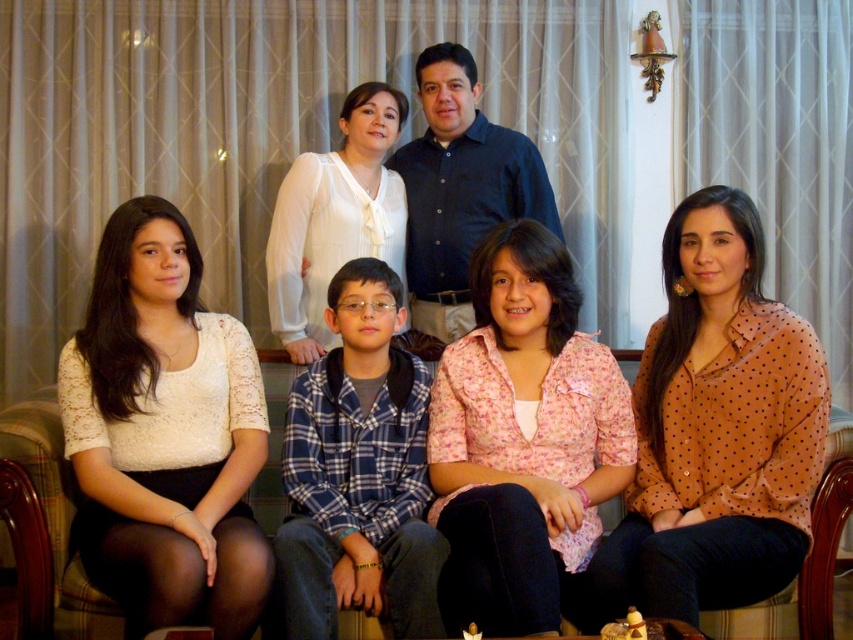
Question: Does brown dotted blouse at lower right have a greater width compared to pink floral blouse at center?

Choices:
 (A) yes
 (B) no

Answer: (A)

Question: Estimate the real-world distances between objects in this image. Which object is closer to the white sheer blouse at upper center?

Choices:
 (A) pink floral blouse at center
 (B) brown dotted blouse at lower right

Answer: (A)

Question: Does brown dotted blouse at lower right have a smaller size compared to white sheer blouse at upper center?

Choices:
 (A) no
 (B) yes

Answer: (A)

Question: Which of the following is the farthest from the observer?

Choices:
 (A) (700, 234)
 (B) (134, 460)

Answer: (A)

Question: Estimate the real-world distances between objects in this image. Which object is farther from the white lace blouse at lower left?

Choices:
 (A) brown dotted blouse at lower right
 (B) white sheer blouse at upper center

Answer: (A)

Question: Does white lace blouse at lower left appear on the left side of white sheer blouse at upper center?

Choices:
 (A) yes
 (B) no

Answer: (A)